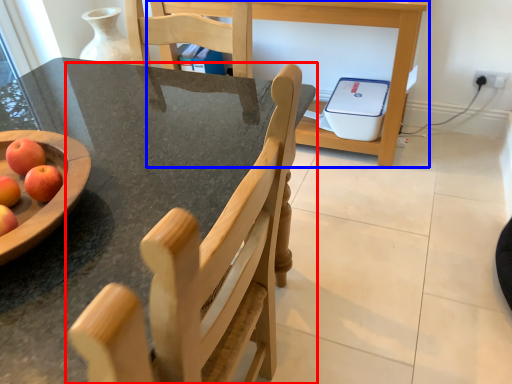
Question: Among these objects, which one is farthest to the camera, chair (highlighted by a red box) or table (highlighted by a blue box)?

Choices:
 (A) chair
 (B) table

Answer: (B)